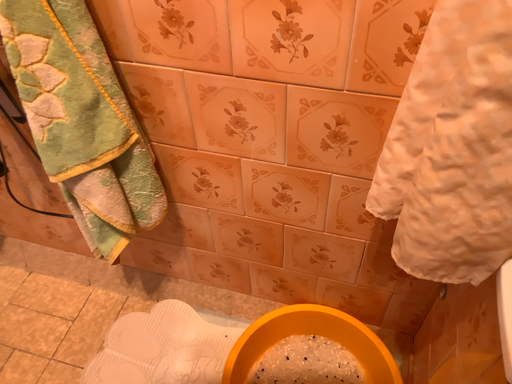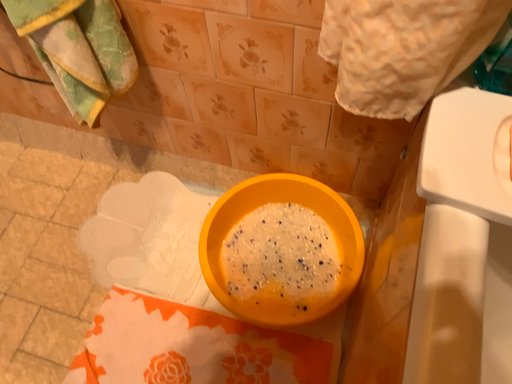
Question: How did the camera likely rotate when shooting the video?

Choices:
 (A) rotated upward
 (B) rotated downward

Answer: (B)